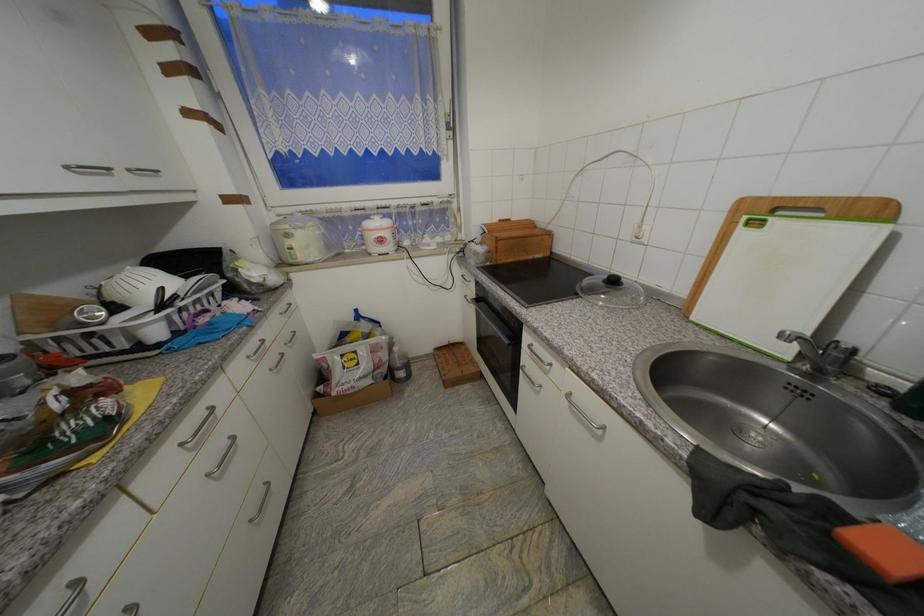
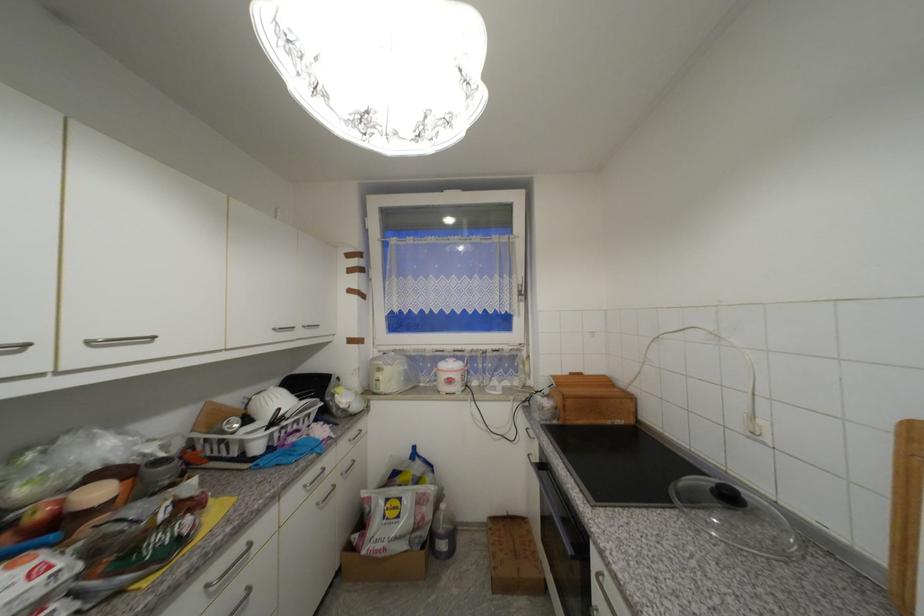
In the second image, find the point that corresponds to (294,237) in the first image.

(385, 371)